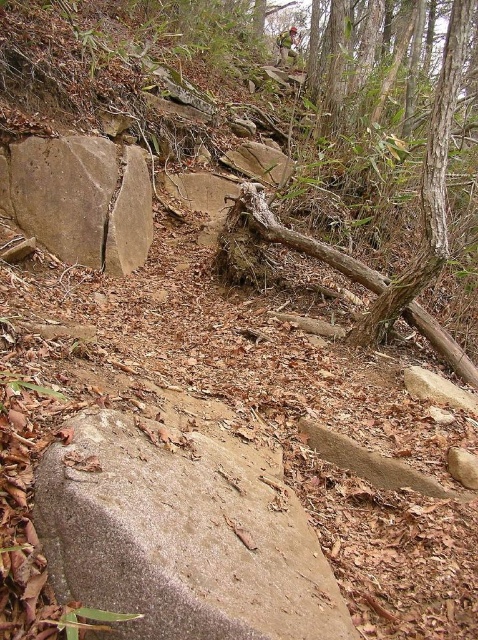
Who is lower down, gray rough stone at center or brown rough log at center?

gray rough stone at center

At what (x,y) coordinates should I click in order to perform the action: click on gray rough stone at center. Please return your answer as a coordinate pair (x, y). Looking at the image, I should click on (181, 538).

Find the location of a particular element. The image size is (478, 640). gray rough stone at center is located at coordinates (181, 538).

Between brown rough rock at upper left and brown rough log at center, which one appears on the right side from the viewer's perspective?

Positioned to the right is brown rough log at center.

Which is above, brown rough rock at upper left or brown rough log at center?

brown rough rock at upper left is higher up.

Looking at this image, who is more forward, (106, 252) or (442, 161)?

Point (442, 161)

This screenshot has height=640, width=478. In order to click on brown rough rock at upper left in this screenshot , I will do `click(80, 198)`.

Who is positioned more to the right, gray rough stone at center or brown rough rock at upper left?

From the viewer's perspective, gray rough stone at center appears more on the right side.

Does gray rough stone at center appear on the right side of brown rough rock at upper left?

Correct, you'll find gray rough stone at center to the right of brown rough rock at upper left.

You are a GUI agent. You are given a task and a screenshot of the screen. Output one action in this format:
    pyautogui.click(x=<x>, y=<y>)
    Task: Click on the gray rough stone at center
    The height and width of the screenshot is (640, 478).
    Given the screenshot: What is the action you would take?
    pyautogui.click(x=181, y=538)

Where is `gray rough stone at center`? This screenshot has width=478, height=640. gray rough stone at center is located at coordinates (181, 538).